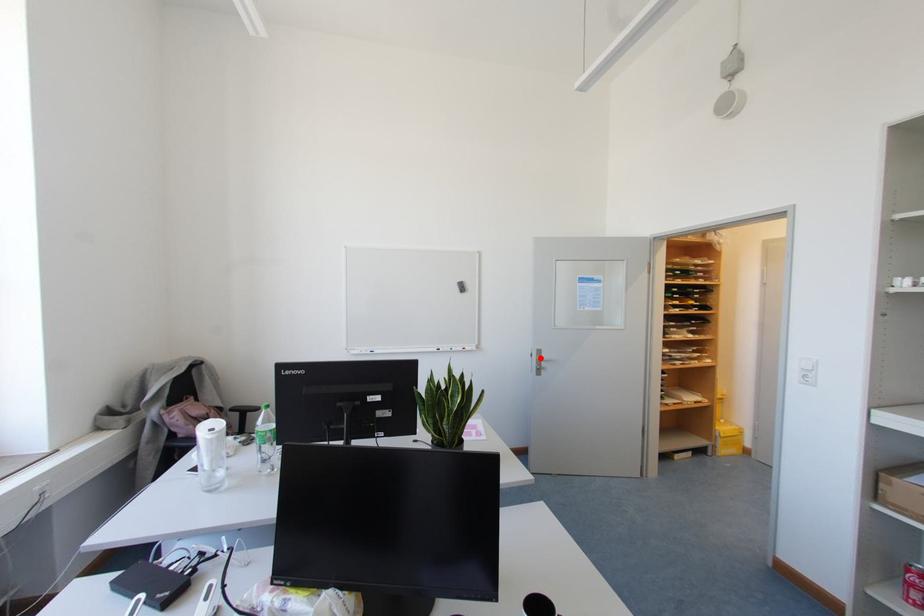
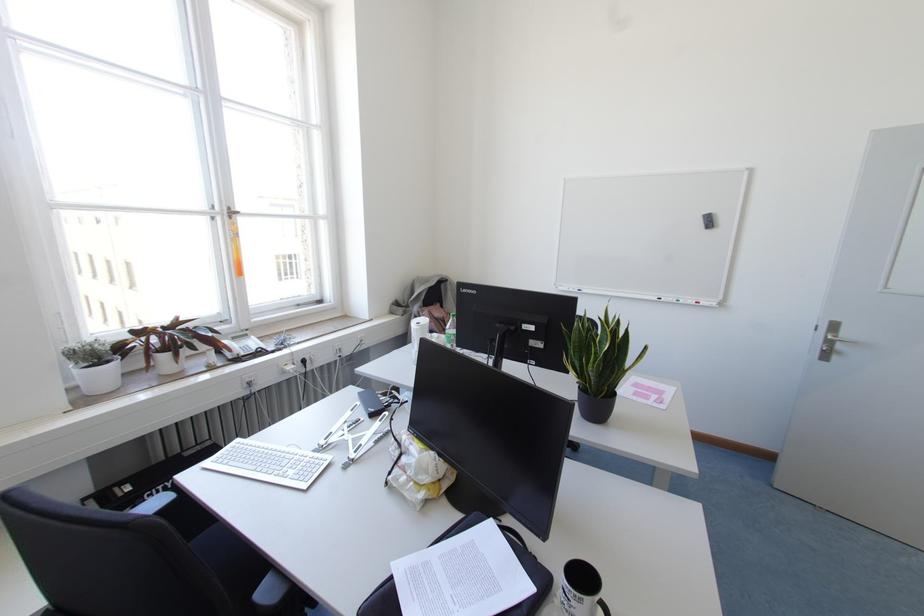
Where in the second image is the point corresponding to the highlighted location from the first image?

(834, 336)